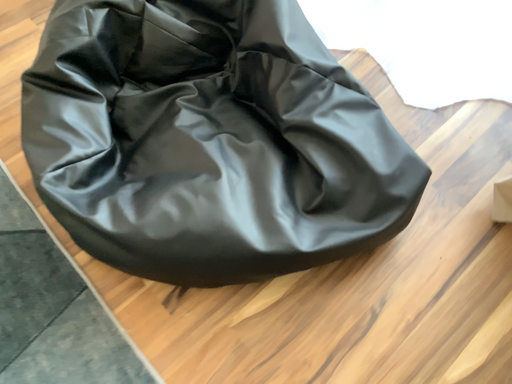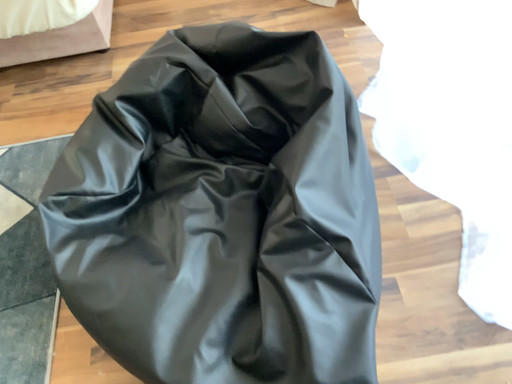
Question: How did the camera likely rotate when shooting the video?

Choices:
 (A) rotated left
 (B) rotated right

Answer: (A)